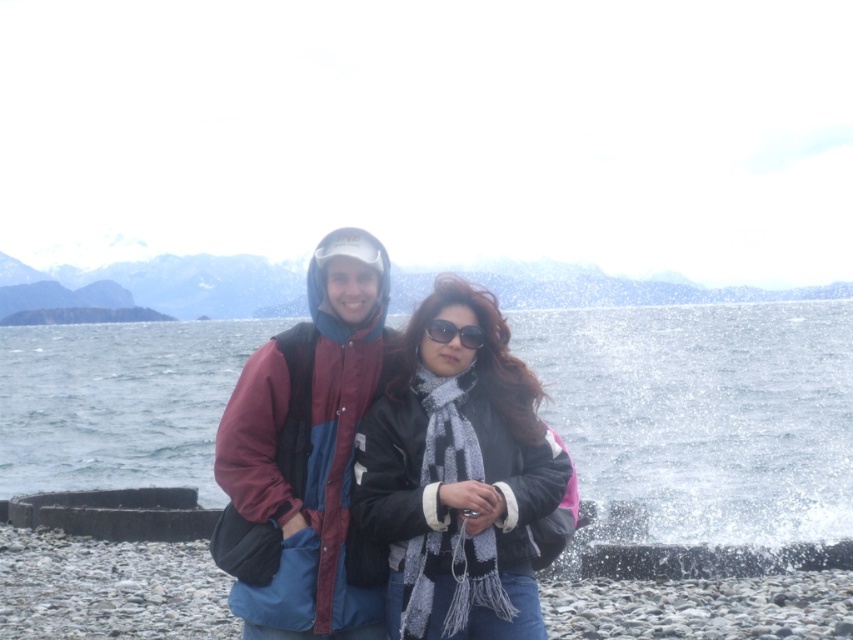
Is point (33, 461) positioned before point (424, 627)?

That is False.

Is clear water at center in front of black matte jacket at center?

That is False.

At what (x,y) coordinates should I click in order to perform the action: click on clear water at center. Please return your answer as a coordinate pair (x, y). This screenshot has height=640, width=853. Looking at the image, I should click on (705, 413).

Where is `clear water at center`? This screenshot has height=640, width=853. clear water at center is located at coordinates (705, 413).

This screenshot has width=853, height=640. I want to click on black matte jacket at center, so click(462, 480).

In the scene shown: Is black matte jacket at center positioned behind maroon and blue jacket at center?

No, black matte jacket at center is closer to the viewer.

Who is more distant from viewer, (532,388) or (277,490)?

Positioned behind is point (532,388).

In order to click on black matte jacket at center in this screenshot , I will do `click(462, 480)`.

Does clear water at center have a greater height compared to black plastic sunglasses at center?

Correct, clear water at center is much taller as black plastic sunglasses at center.

Who is higher up, clear water at center or black plastic sunglasses at center?

clear water at center is above.

The image size is (853, 640). Describe the element at coordinates (705, 413) in the screenshot. I see `clear water at center` at that location.

Locate an element on the screen. The height and width of the screenshot is (640, 853). clear water at center is located at coordinates (705, 413).